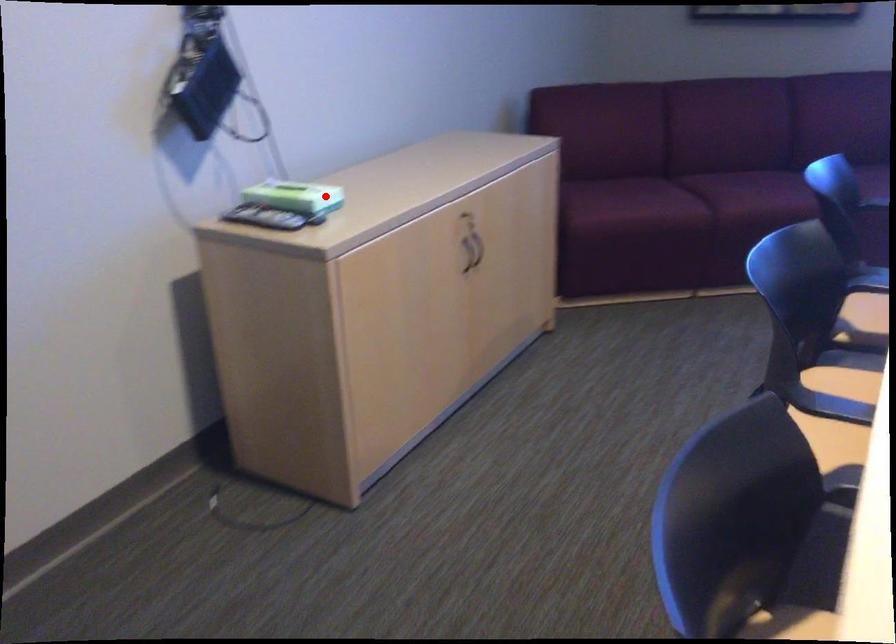
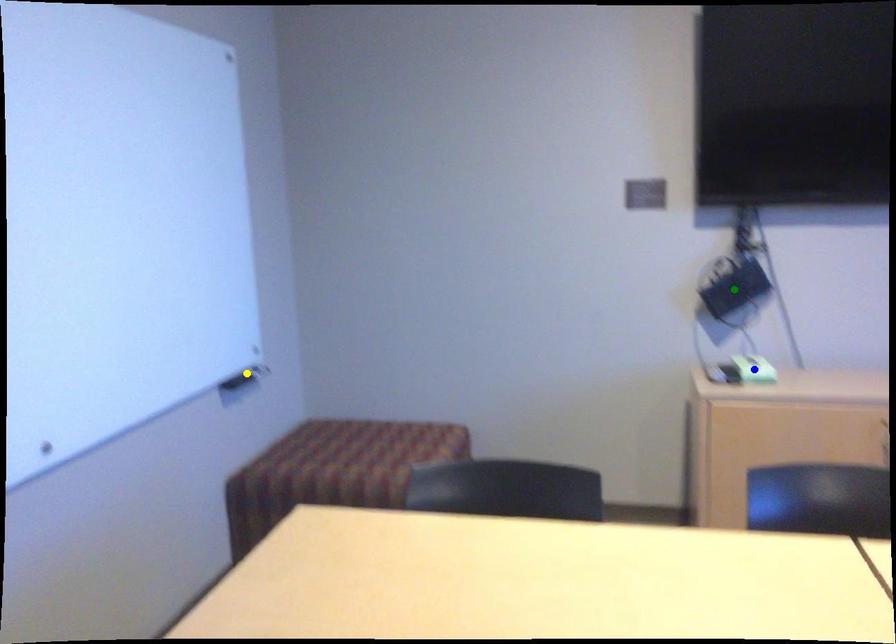
Question: I am providing you with two images of the same scene from different viewpoints. A red point is marked on the first image. You are given multiple points on the second image. Which mark in image 2 goes with the point in image 1?

Choices:
 (A) green point
 (B) yellow point
 (C) blue point

Answer: (C)